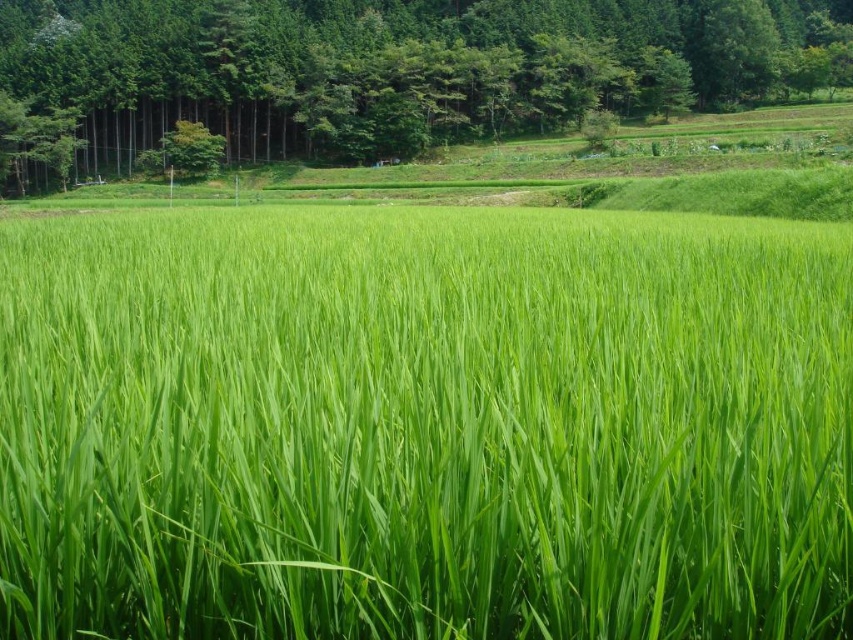
You are standing at the origin point in the rice paddy field. Which direction should you walk to reach the green grassy field at center?

The green grassy field at center is located at point 0.666 on the x axis and 0.498 on the y axis, so you should walk northeast to reach it.

You are standing in the rice paddy field and want to take a photo of both the green grassy field at center and the green leafy tree at upper center. Which object should you focus on first to ensure both are in sharp focus?

You should focus on the green grassy field at center first because it is closer to you than the green leafy tree at upper center, so adjusting focus from near to far will help both be in sharp focus.